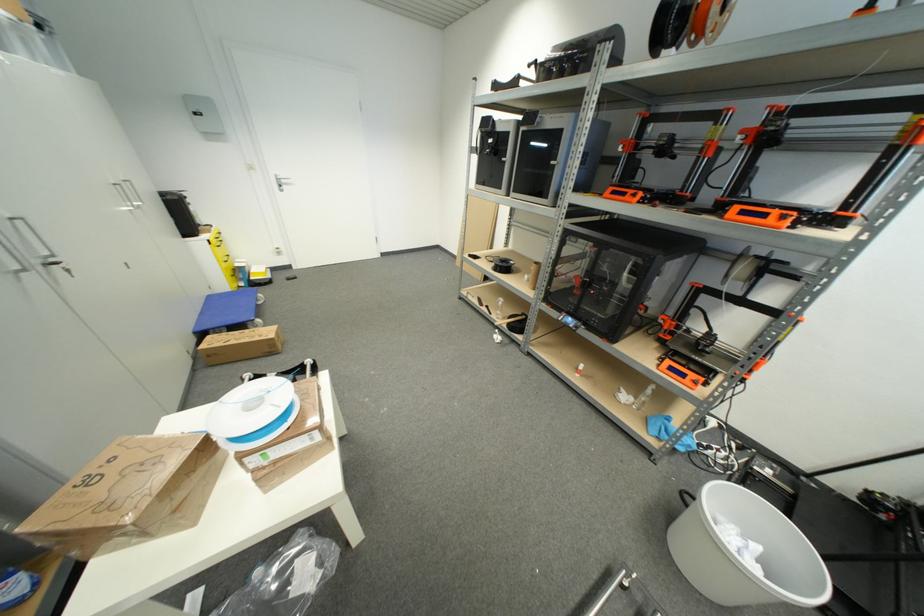
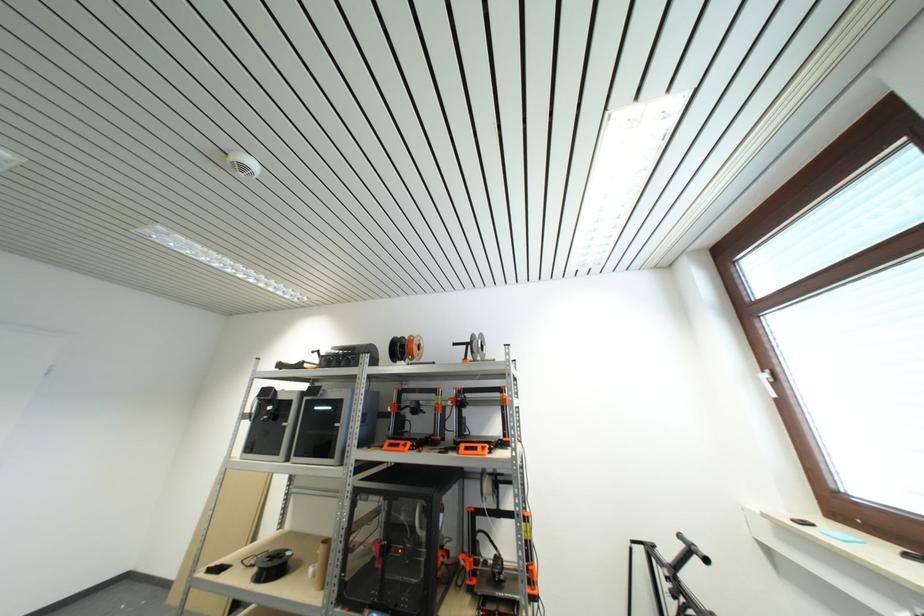
Locate, in the second image, the point that corresponds to the point at 530,280 in the first image.

(314, 573)